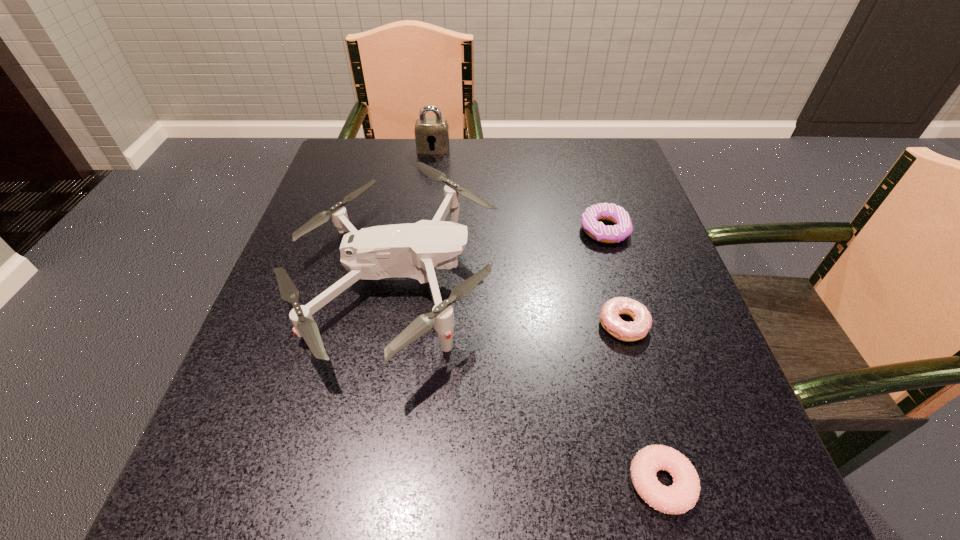
What are the coordinates of `vacant space located 0.170m on the left of the nearest doughnut` in the screenshot? It's located at (499, 483).

This screenshot has width=960, height=540. I want to click on object present at the far edge, so [x=431, y=134].

The width and height of the screenshot is (960, 540). I want to click on object that is positioned at the near edge, so click(682, 495).

This screenshot has height=540, width=960. In order to click on object at the left edge in this screenshot , I will do `click(413, 250)`.

Identify the location of object that is at the near right corner. [682, 495].

The height and width of the screenshot is (540, 960). In the image, there is a desktop. What are the coordinates of `vacant space at the far edge` in the screenshot? It's located at (477, 151).

In order to click on free space at the near edge of the desktop in this screenshot , I will do `click(457, 476)`.

The image size is (960, 540). In the image, there is a desktop. Identify the location of vacant space at the left edge. (248, 353).

This screenshot has width=960, height=540. Find the location of `free space at the right edge`. free space at the right edge is located at coordinates tap(653, 251).

Locate an element on the screen. Image resolution: width=960 pixels, height=540 pixels. blank space at the far left corner of the desktop is located at coordinates (341, 152).